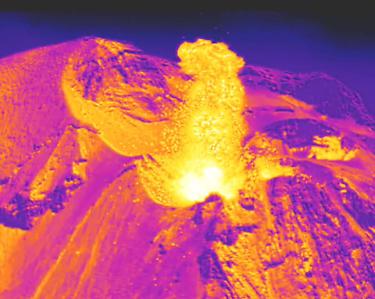
I want to click on white light, so click(212, 190).